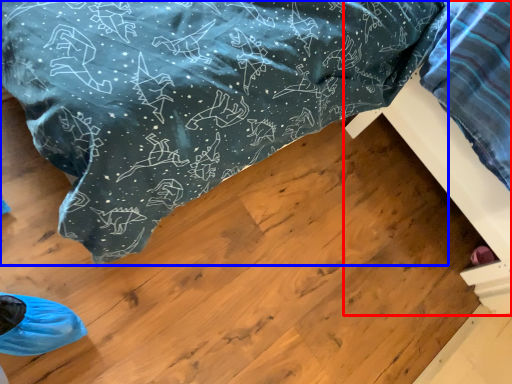
Question: Which object is closer to the camera taking this photo, furniture (highlighted by a red box) or furniture (highlighted by a blue box)?

Choices:
 (A) furniture
 (B) furniture

Answer: (A)